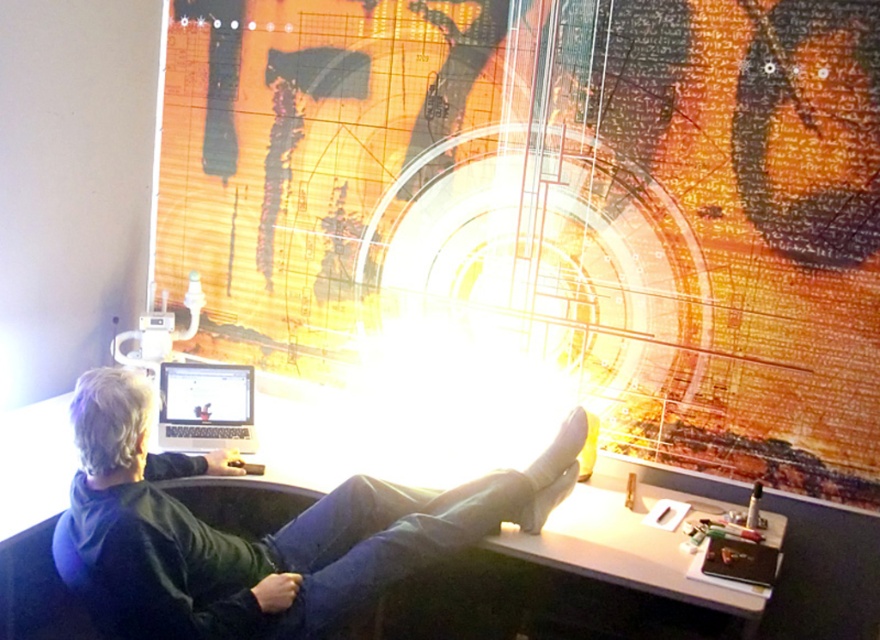
You are standing in the office and want to place a new poster on the wall. The point where you want to hang it is located at coordinates point (679, 97). If your arm reaches 2 meters, can you reach that point without a ladder?

The distance of point (679, 97) is 2.50 meters away from the viewer. Since your arm reaches only 2 meters, you cannot reach that point without a ladder.

You are organizing the desk and need to place a new item between the matte orange poster at upper center and the black leather jacket at center. Based on their positions, which object should be placed closer to the left side of the desk?

The black leather jacket at center is to the left of the matte orange poster at upper center, so placing the new item closer to the left side would mean positioning it near the black leather jacket at center.

You are an office worker who needs to place a new 36 inch wide poster on the wall. You see the matte orange poster at upper center and the satin black laptop at lower left. Can you determine if there is enough space between them to fit your new poster?

The distance between the matte orange poster at upper center and the satin black laptop at lower left is 34.81 inches. Since your new poster is 36 inches wide, it would not fit in the space between them.